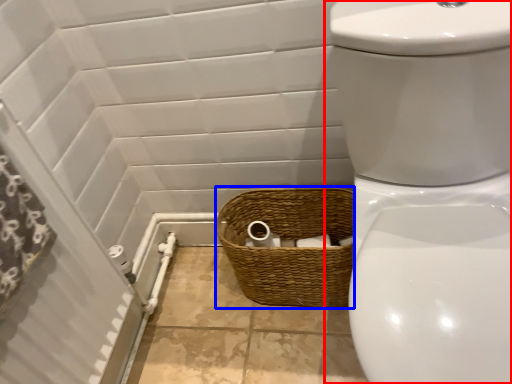
Question: Which point is further to the camera, toilet (highlighted by a red box) or basket (highlighted by a blue box)?

Choices:
 (A) toilet
 (B) basket

Answer: (B)